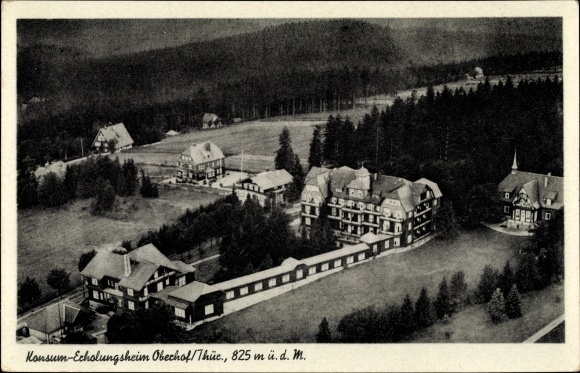
Identify the location of windows. (233, 290), (245, 293), (258, 286), (273, 282), (288, 279), (316, 273), (324, 266), (337, 262), (351, 259), (358, 259).